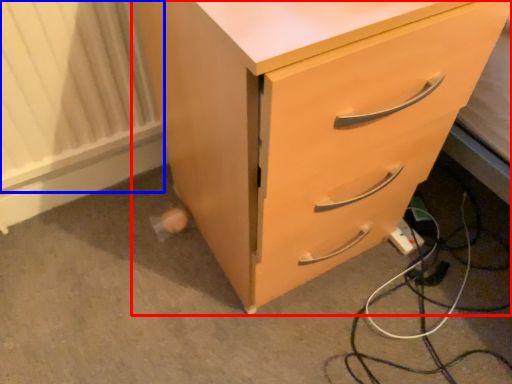
Question: Which point is further to the camera, chest of drawers (highlighted by a red box) or radiator (highlighted by a blue box)?

Choices:
 (A) chest of drawers
 (B) radiator

Answer: (B)